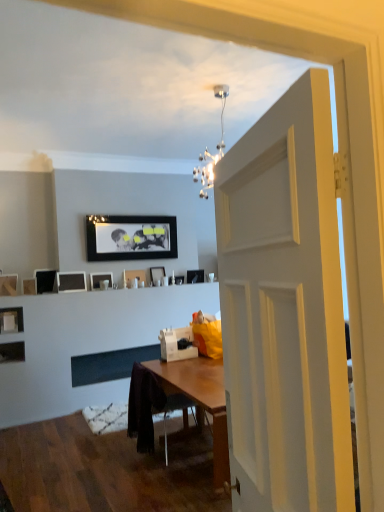
Locate an element on the screen. vacant space underneath matte black picture frame at center, placed as the seventh picture frame when sorted from right to left (from a real-world perspective) is located at coordinates (75, 352).